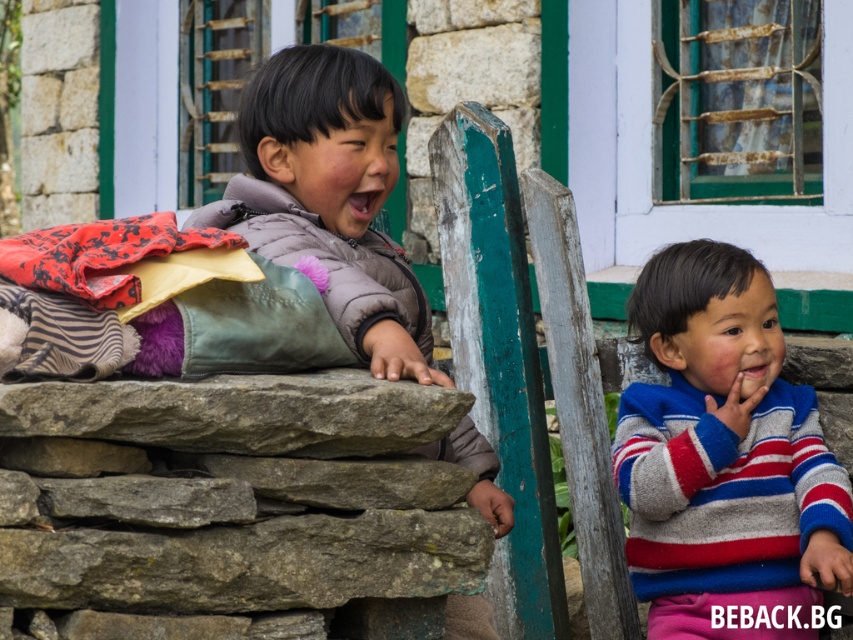
Which is more to the left, striped wool sweater at right or matte gray jacket at center?

From the viewer's perspective, matte gray jacket at center appears more on the left side.

I want to click on striped wool sweater at right, so click(x=724, y=458).

Who is more distant from viewer, (694, 465) or (337, 257)?

Positioned behind is point (337, 257).

Where is `striped wool sweater at right`? striped wool sweater at right is located at coordinates (724, 458).